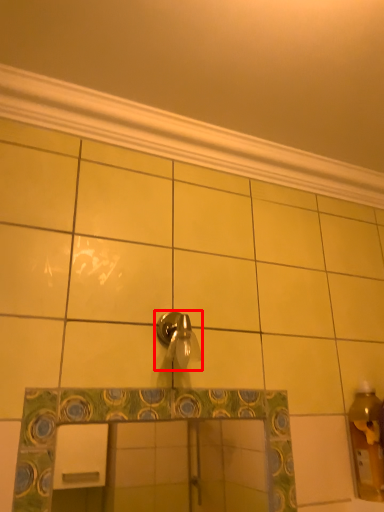
Question: In this image, where is tap (annotated by the red box) located relative to molding?

Choices:
 (A) left
 (B) right

Answer: (A)